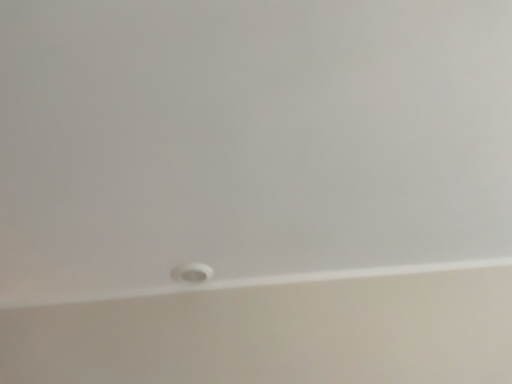
Identify the location of white glossy light fixture at center. (192, 273).

Describe the element at coordinates (192, 273) in the screenshot. This screenshot has height=384, width=512. I see `white glossy light fixture at center` at that location.

Identify the location of white glossy light fixture at center. (192, 273).